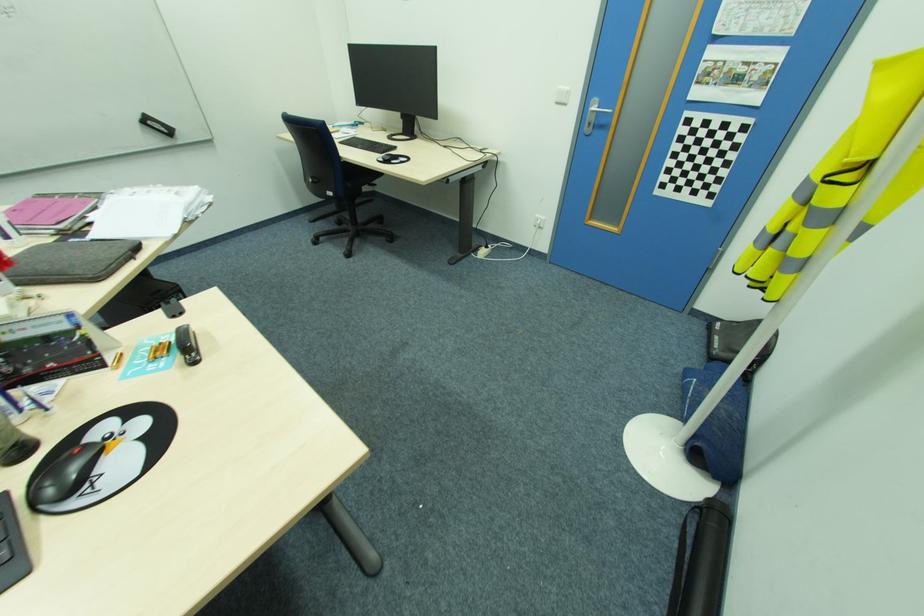
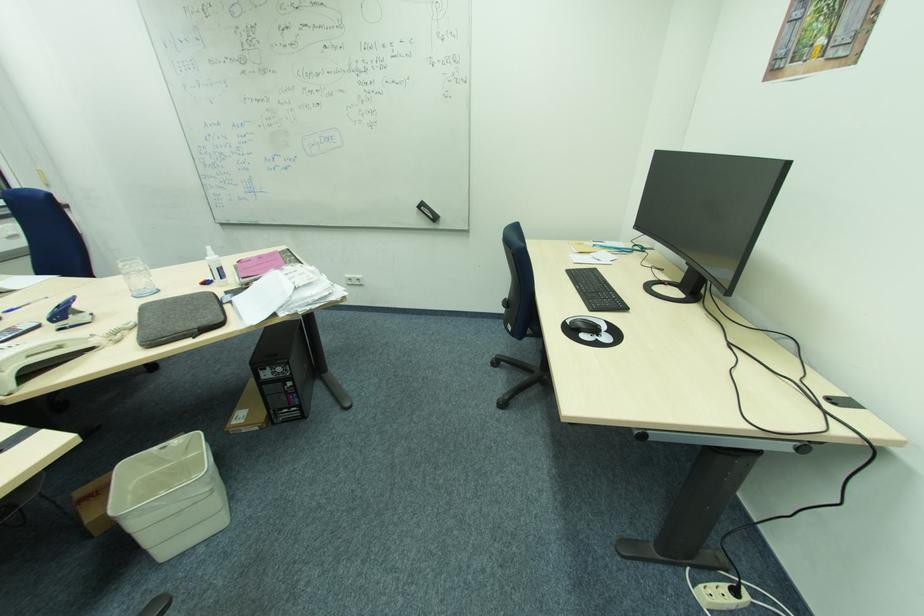
In the second image, find the point that corresponds to point (383, 160) in the first image.

(572, 323)